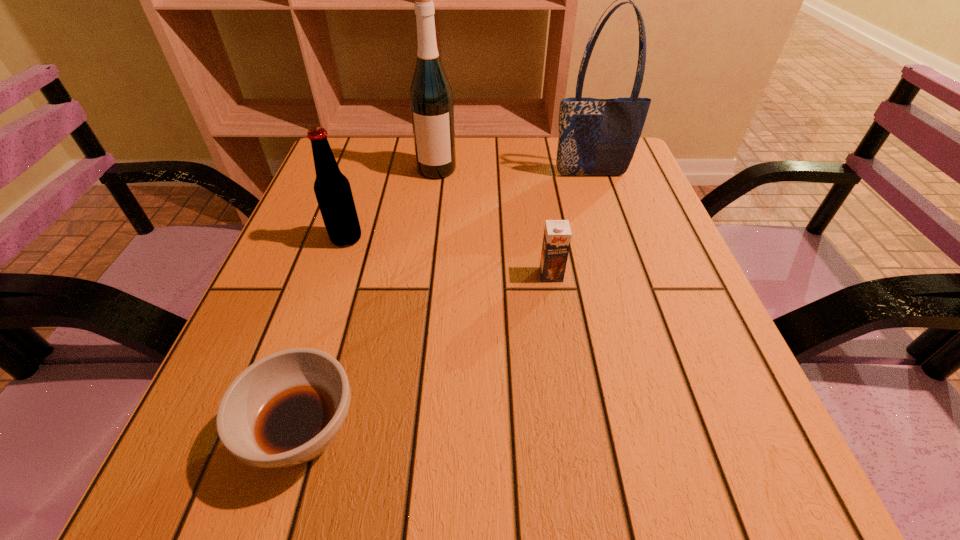
Identify the location of shopping bag. Image resolution: width=960 pixels, height=540 pixels. (597, 137).

Find the location of a particular element. This screenshot has height=540, width=960. wine bottle is located at coordinates (431, 100).

This screenshot has height=540, width=960. Find the location of `beer bottle`. beer bottle is located at coordinates (332, 189).

You are a GUI agent. You are given a task and a screenshot of the screen. Output one action in this format:
    pyautogui.click(x=<x>, y=<y>)
    Task: Click on the third farthest object
    This screenshot has height=540, width=960.
    Given the screenshot: What is the action you would take?
    pyautogui.click(x=332, y=189)

At what (x,y) coordinates should I click in order to perform the action: click on the fourth farthest object. Please return your answer as a coordinate pair (x, y). This screenshot has height=540, width=960. Looking at the image, I should click on (557, 234).

The image size is (960, 540). I want to click on the fourth object from left to right, so click(x=557, y=234).

Identify the location of the nearest object. The image size is (960, 540). (285, 409).

Locate an element on the screen. soup bowl is located at coordinates (285, 409).

Image resolution: width=960 pixels, height=540 pixels. In order to click on free point located on the front-facing side of the rightmost object in this screenshot , I will do `click(597, 194)`.

Where is `vacant region located on the label of the third object from right to left`? This screenshot has width=960, height=540. vacant region located on the label of the third object from right to left is located at coordinates (434, 195).